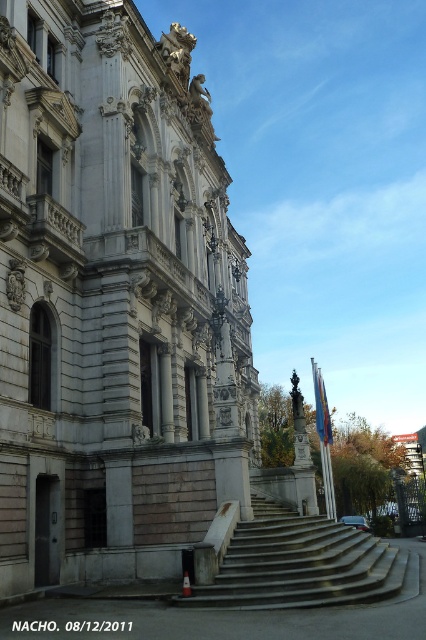
Question: Which of the following is the farthest from the observer?

Choices:
 (A) concrete stairs at center
 (B) white stone palace at center

Answer: (B)

Question: Can you confirm if white stone palace at center is smaller than concrete stairs at center?

Choices:
 (A) yes
 (B) no

Answer: (B)

Question: Can you confirm if white stone palace at center is bigger than concrete stairs at center?

Choices:
 (A) no
 (B) yes

Answer: (B)

Question: Is white stone palace at center thinner than concrete stairs at center?

Choices:
 (A) yes
 (B) no

Answer: (B)

Question: Among these points, which one is nearest to the camera?

Choices:
 (A) (241, 324)
 (B) (268, 568)

Answer: (B)